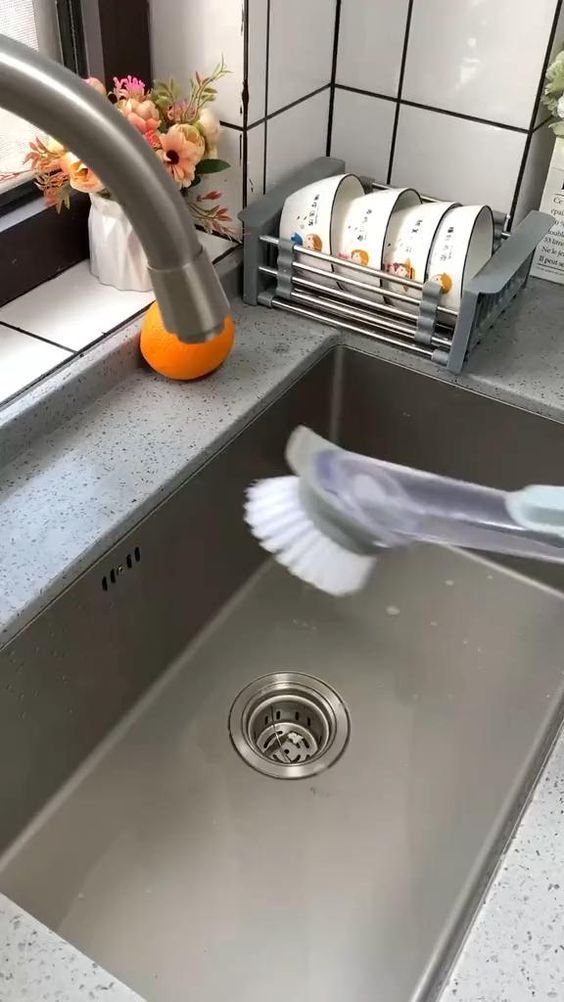
This screenshot has height=1002, width=564. What are the coordinates of `faucet` in the screenshot? It's located at (191, 279).